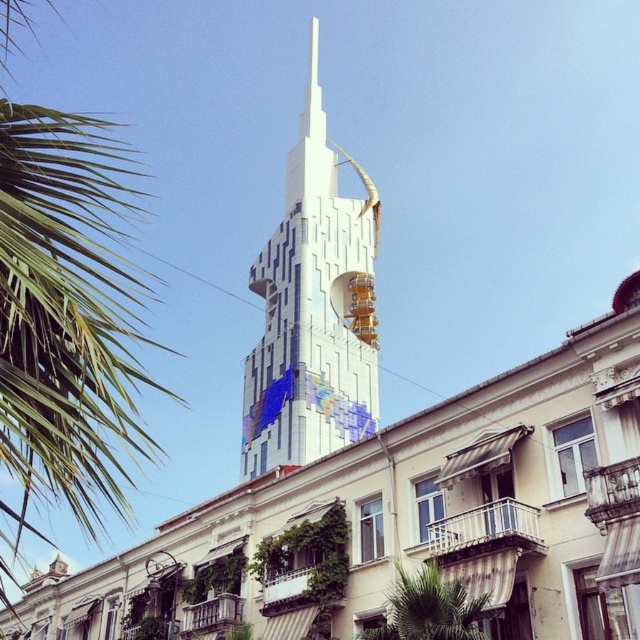
Between green leafy palm tree at upper left and white glossy bell tower at center, which one is positioned higher?

white glossy bell tower at center is higher up.

Does green leafy palm tree at upper left appear over white glossy bell tower at center?

No.

Who is more distant from viewer, (x=12, y=580) or (x=300, y=444)?

The point (x=12, y=580) is behind.

Find the location of a particular element. This screenshot has width=640, height=640. green leafy palm tree at upper left is located at coordinates (67, 316).

Between white glossy bell tower at center and green leafy palm tree at lower center, which one has less height?

green leafy palm tree at lower center

Who is taller, white glossy bell tower at center or green leafy palm tree at lower center?

white glossy bell tower at center

Describe the element at coordinates (312, 310) in the screenshot. I see `white glossy bell tower at center` at that location.

You are a GUI agent. You are given a task and a screenshot of the screen. Output one action in this format:
    pyautogui.click(x=<x>, y=<y>)
    Task: Click on the white glossy bell tower at center
    The height and width of the screenshot is (640, 640).
    Given the screenshot: What is the action you would take?
    pyautogui.click(x=312, y=310)

Can you confirm if green leafy palm tree at upper left is positioned to the left of green leafy palm tree at lower center?

Yes, green leafy palm tree at upper left is to the left of green leafy palm tree at lower center.

Which of these two, green leafy palm tree at upper left or green leafy palm tree at lower center, stands shorter?

With less height is green leafy palm tree at lower center.

Where is `green leafy palm tree at upper left`? The height and width of the screenshot is (640, 640). green leafy palm tree at upper left is located at coordinates (67, 316).